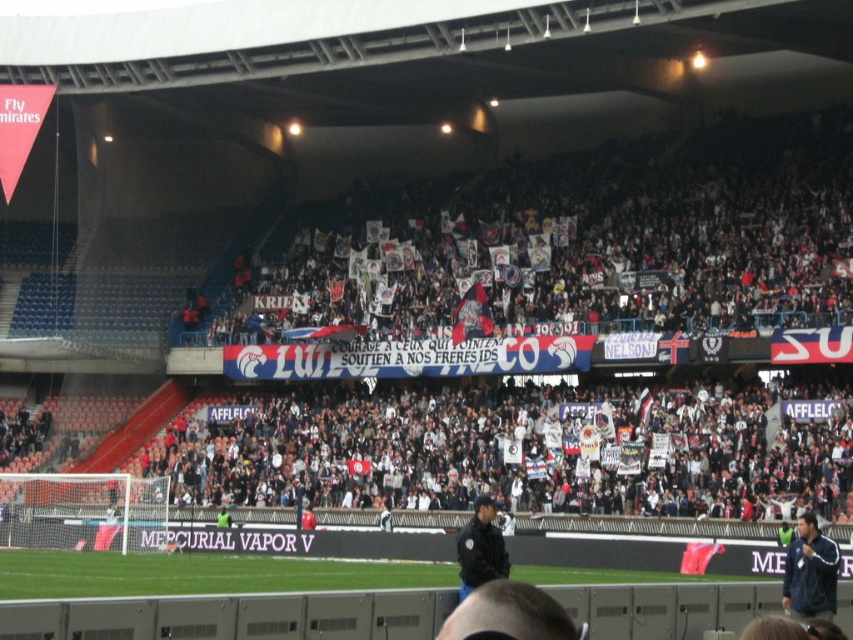
Is blue fabric jacket at lower right positioned behind black uniform at center?

No, it is in front of black uniform at center.

Is blue fabric jacket at lower right above black uniform at center?

Yes, blue fabric jacket at lower right is above black uniform at center.

Where is `blue fabric jacket at lower right`? The image size is (853, 640). blue fabric jacket at lower right is located at coordinates (810, 572).

This screenshot has height=640, width=853. In order to click on blue fabric jacket at lower right in this screenshot , I will do `click(810, 572)`.